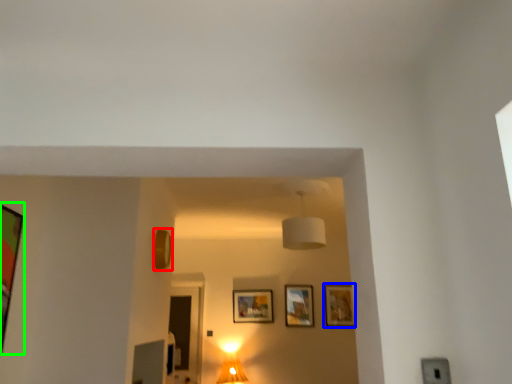
Question: Estimate the real-world distances between objects in this image. Which object is closer to picture frame (highlighted by a red box), picture frame (highlighted by a blue box) or picture frame (highlighted by a green box)?

Choices:
 (A) picture frame
 (B) picture frame

Answer: (B)